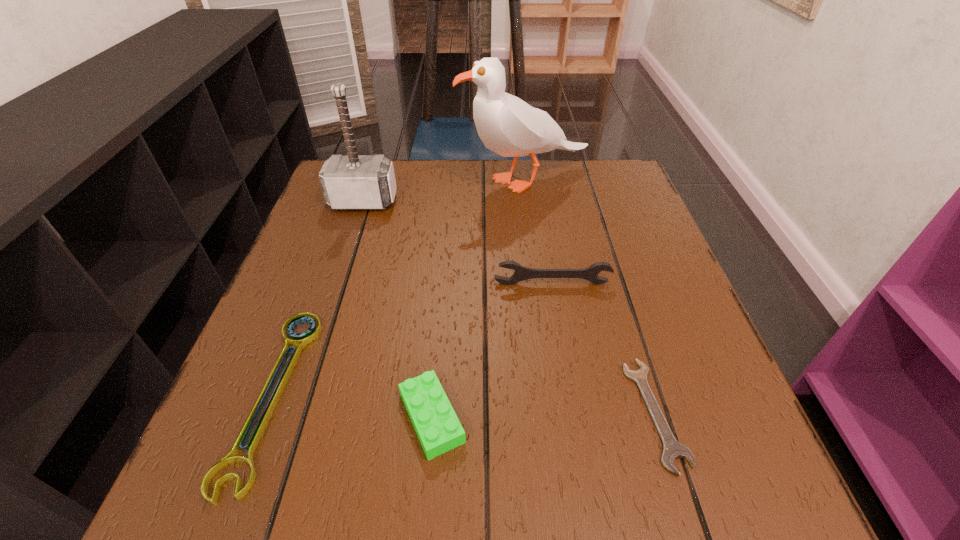
Image resolution: width=960 pixels, height=540 pixels. I want to click on free point at the near left corner, so pos(207,455).

Find the location of a particular element. free region at the far right corner of the desktop is located at coordinates (633, 180).

Image resolution: width=960 pixels, height=540 pixels. I want to click on free region at the near right corner, so click(x=700, y=495).

Locate an element on the screen. vacant region between the hammer and the fifth tallest object is located at coordinates 318,298.

You are a GUI agent. You are given a task and a screenshot of the screen. Output one action in this format:
    pyautogui.click(x=<x>, y=<y>)
    Task: Click on the free space between the shortest object and the fourth tallest object
    
    Given the screenshot: What is the action you would take?
    pyautogui.click(x=543, y=415)

Identify the location of vacant space that's between the leftmost wrench and the shortest object. (464, 404).

At what (x,y) coordinates should I click in order to perform the action: click on blank region between the farthest wrench and the gull. Please return your answer as a coordinate pair (x, y). Looking at the image, I should click on (539, 232).

Where is `unoccupied position between the fifth tallest object and the tallest wrench`? Image resolution: width=960 pixels, height=540 pixels. unoccupied position between the fifth tallest object and the tallest wrench is located at coordinates (412, 340).

Locate an element on the screen. The width and height of the screenshot is (960, 540). unoccupied position between the gull and the tallest wrench is located at coordinates (539, 232).

Locate an element on the screen. This screenshot has width=960, height=540. vacant point located between the shortest wrench and the hammer is located at coordinates (510, 307).